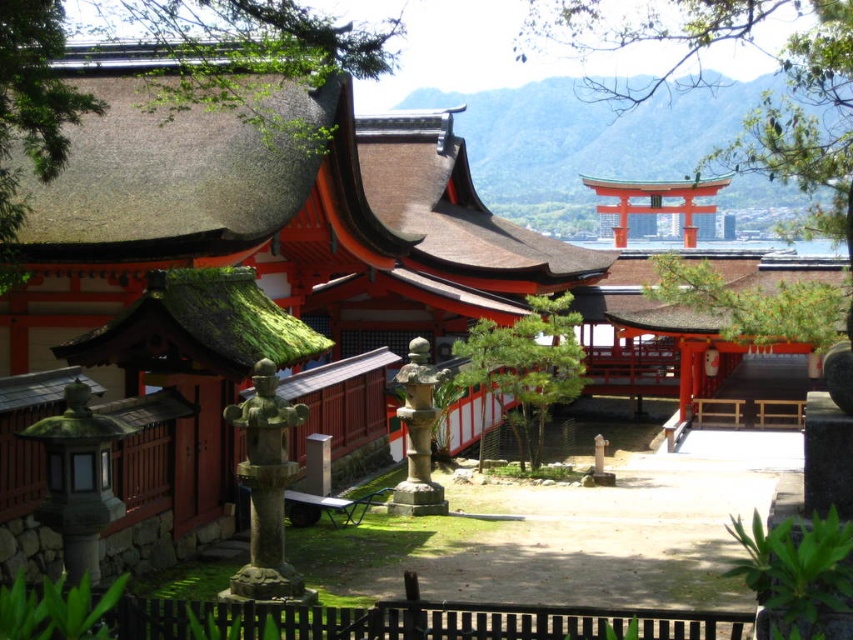
Between point (268, 544) and point (410, 390), which one is positioned in front?

Point (268, 544)

Between gray stone statue at center and stone lantern at center, which one has less height?

Standing shorter between the two is stone lantern at center.

Identify the location of gray stone statue at center. Image resolution: width=853 pixels, height=640 pixels. (265, 490).

Which of these two, green textured pine tree at center or gray stone statue at center, stands taller?

green textured pine tree at center is taller.

Does point (799, 296) lie behind point (230, 412)?

Yes, point (799, 296) is farther from viewer.

Find the location of a particular element. The height and width of the screenshot is (640, 853). green textured pine tree at center is located at coordinates (755, 305).

This screenshot has height=640, width=853. Identify the location of green textured pine tree at center. (755, 305).

Is point (541, 435) positioned after point (294, 593)?

Yes, point (541, 435) is farther from viewer.

Who is more distant from viewer, (531,416) or (305,413)?

Point (531,416)

Who is more forward, (x=494, y=388) or (x=271, y=513)?

Point (x=271, y=513) is in front.

Where is `green textured stone at center`? green textured stone at center is located at coordinates (526, 368).